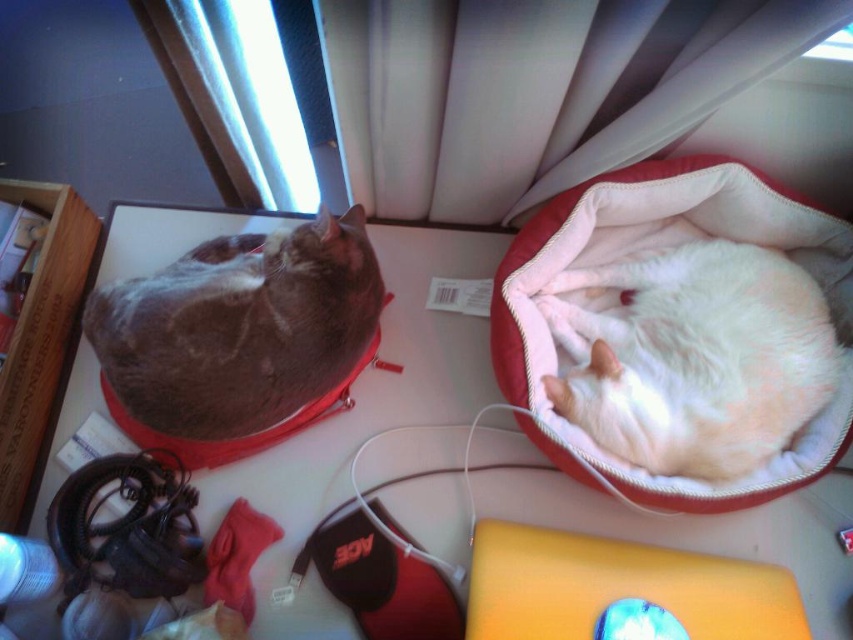
Question: Which point is farther to the camera?

Choices:
 (A) (196, 508)
 (B) (209, 397)

Answer: (A)

Question: Does white glossy table at center lie behind gray fur cat at left?

Choices:
 (A) no
 (B) yes

Answer: (A)

Question: Which object appears farthest from the camera in this image?

Choices:
 (A) white fluffy cat at center
 (B) white glossy table at center
 (C) gray fur cat at left

Answer: (C)

Question: Which object appears closest to the camera in this image?

Choices:
 (A) white glossy table at center
 (B) white fluffy cat at center
 (C) gray fur cat at left

Answer: (B)

Question: Does white glossy table at center have a larger size compared to gray fur cat at left?

Choices:
 (A) yes
 (B) no

Answer: (A)

Question: Observing the image, what is the correct spatial positioning of white glossy table at center in reference to white fluffy cat at center?

Choices:
 (A) below
 (B) above

Answer: (A)